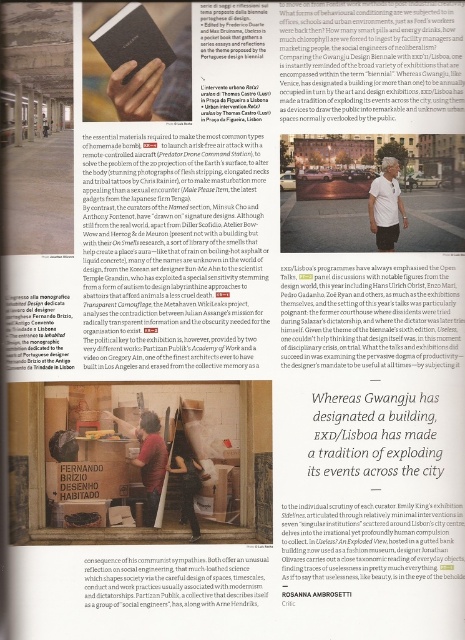
You are trying to decide which clothing item to wear for a casual day out. You have the white cotton shirt at center and the dark brown leather jacket at center. Which item is narrower?

The white cotton shirt at center has a lesser width compared to the dark brown leather jacket at center, so the white cotton shirt at center is narrower.

You are organizing a small exhibition and need to place both the white cotton shirt at center and the wooden table at center in a narrow space. Which object should you prioritize placing first to ensure both fit?

The white cotton shirt at center has a lesser width compared to the wooden table at center, so you should place the wooden table at center first to accommodate its larger width, then fit the white cotton shirt at center alongside it.